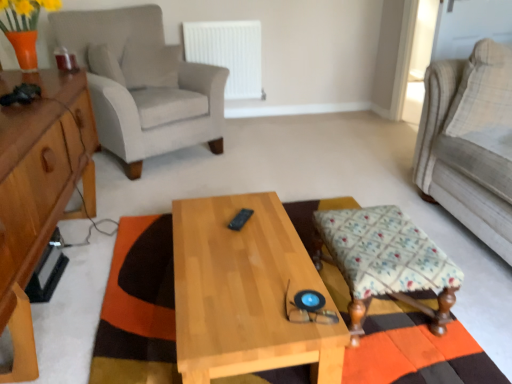
Question: Is orange and brown woven mat at center further to the viewer compared to white plastic radiator at upper center?

Choices:
 (A) no
 (B) yes

Answer: (A)

Question: Is white plastic radiator at upper center a part of orange and brown woven mat at center?

Choices:
 (A) no
 (B) yes

Answer: (A)

Question: Is orange and brown woven mat at center at the left side of white plastic radiator at upper center?

Choices:
 (A) yes
 (B) no

Answer: (B)

Question: Does orange and brown woven mat at center come in front of white plastic radiator at upper center?

Choices:
 (A) yes
 (B) no

Answer: (A)

Question: Is orange and brown woven mat at center to the right of white plastic radiator at upper center from the viewer's perspective?

Choices:
 (A) no
 (B) yes

Answer: (B)

Question: Is orange and brown woven mat at center smaller than white plastic radiator at upper center?

Choices:
 (A) no
 (B) yes

Answer: (A)

Question: From the image's perspective, does orange and brown woven mat at center appear lower than floral fabric stool at lower right?

Choices:
 (A) yes
 (B) no

Answer: (A)

Question: Is orange and brown woven mat at center not inside floral fabric stool at lower right?

Choices:
 (A) no
 (B) yes

Answer: (B)

Question: Would you say orange and brown woven mat at center is a long distance from floral fabric stool at lower right?

Choices:
 (A) no
 (B) yes

Answer: (A)

Question: Considering the relative sizes of orange and brown woven mat at center and floral fabric stool at lower right in the image provided, is orange and brown woven mat at center smaller than floral fabric stool at lower right?

Choices:
 (A) no
 (B) yes

Answer: (A)

Question: Is orange and brown woven mat at center wider than floral fabric stool at lower right?

Choices:
 (A) no
 (B) yes

Answer: (B)

Question: Does orange and brown woven mat at center lie behind floral fabric stool at lower right?

Choices:
 (A) yes
 (B) no

Answer: (B)

Question: Can you confirm if light beige fabric couch at right is thinner than white plastic radiator at upper center?

Choices:
 (A) no
 (B) yes

Answer: (A)